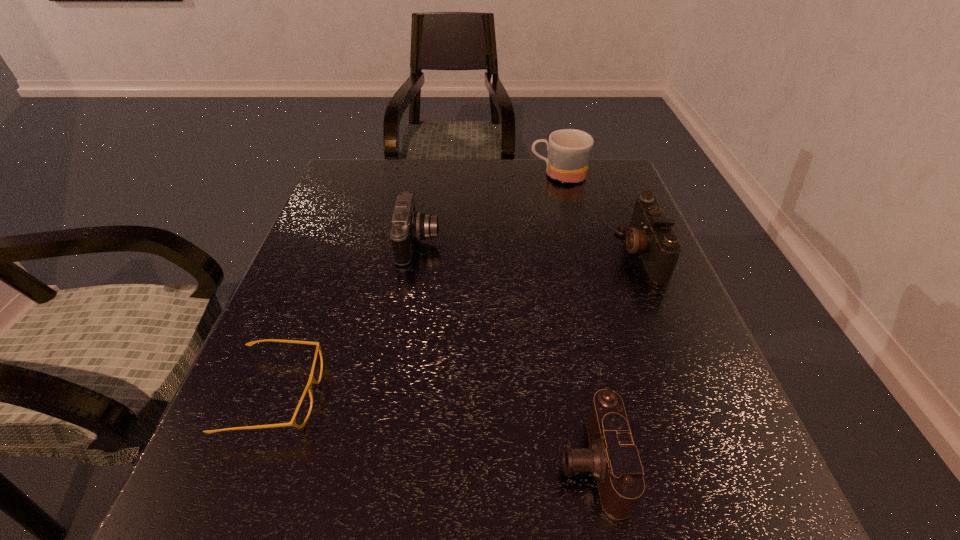
Where is `object that is the fourth closest to the spectacles`? The image size is (960, 540). object that is the fourth closest to the spectacles is located at coordinates (569, 150).

Locate which camera ranks in proximity to the fourth object from right to left. Please provide its 2D coordinates. Your answer should be formatted as a tuple, i.e. [(x, y)], where the tuple contains the x and y coordinates of a point satisfying the conditions above.

[(612, 458)]

Locate an element on the screen. This screenshot has height=540, width=960. camera identified as the second closest to the nearest camera is located at coordinates (408, 226).